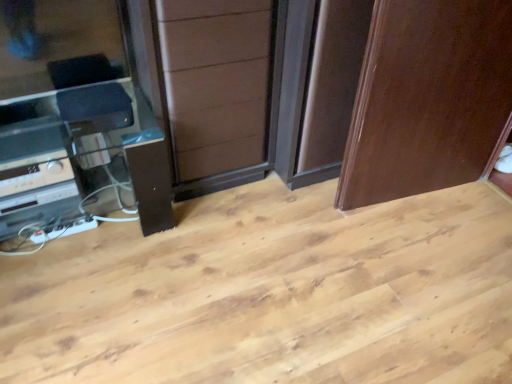
The width and height of the screenshot is (512, 384). I want to click on free area in between brown wood screen door at center and satin black entertainment center at left, so click(214, 213).